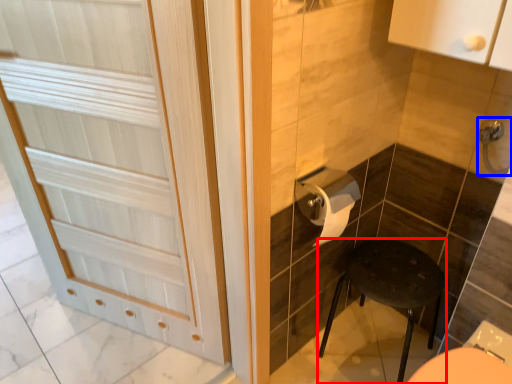
Question: Which object appears farthest to the camera in this image, furniture (highlighted by a red box) or door handle (highlighted by a blue box)?

Choices:
 (A) furniture
 (B) door handle

Answer: (A)